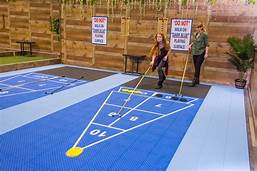
Where is `wood walls`? The height and width of the screenshot is (171, 257). wood walls is located at coordinates (254, 73), (134, 30).